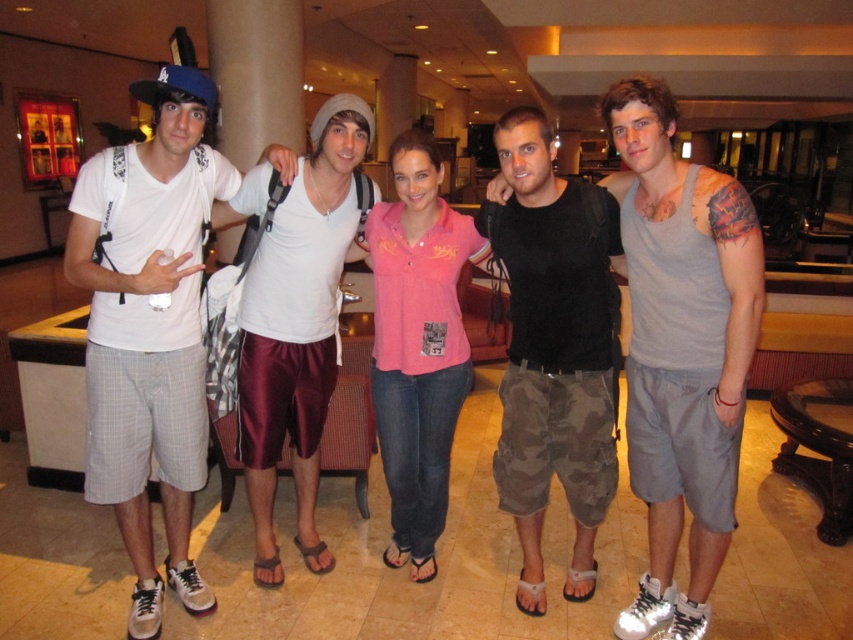
From the picture: Does black cotton t-shirt at center have a greater height compared to pink fabric shirt at center?

Incorrect, black cotton t-shirt at center's height is not larger of pink fabric shirt at center's.

Can you confirm if black cotton t-shirt at center is shorter than pink fabric shirt at center?

Indeed, black cotton t-shirt at center has a lesser height compared to pink fabric shirt at center.

Measure the distance between black cotton t-shirt at center and camera.

black cotton t-shirt at center is 7.15 feet from camera.

The width and height of the screenshot is (853, 640). Find the location of `black cotton t-shirt at center`. black cotton t-shirt at center is located at coordinates coord(554,348).

Is white cotton t-shirt at left shorter than gray tank top at center?

No, white cotton t-shirt at left is not shorter than gray tank top at center.

At what (x,y) coordinates should I click in order to perform the action: click on white cotton t-shirt at left. Please return your answer as a coordinate pair (x, y). The image size is (853, 640). Looking at the image, I should click on (149, 326).

Which is more to the right, black cotton t-shirt at center or pink cotton shirt at center?

black cotton t-shirt at center

Is point (596, 387) behind point (415, 195)?

No, it is in front of (415, 195).

The height and width of the screenshot is (640, 853). Describe the element at coordinates (554, 348) in the screenshot. I see `black cotton t-shirt at center` at that location.

You are a GUI agent. You are given a task and a screenshot of the screen. Output one action in this format:
    pyautogui.click(x=<x>, y=<y>)
    Task: Click on the black cotton t-shirt at center
    
    Given the screenshot: What is the action you would take?
    pyautogui.click(x=554, y=348)